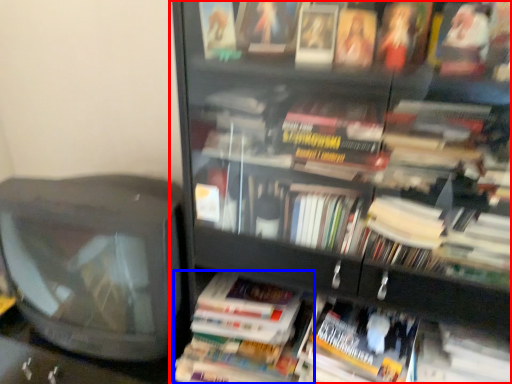
Question: Among these objects, which one is nearest to the camera, bookcase (highlighted by a red box) or paperback book (highlighted by a blue box)?

Choices:
 (A) bookcase
 (B) paperback book

Answer: (A)